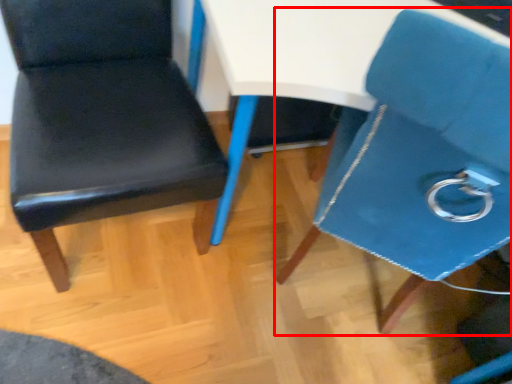
Question: From the image's perspective, what is the correct spatial positioning of chair (annotated by the red box) in reference to chair?

Choices:
 (A) below
 (B) above

Answer: (A)